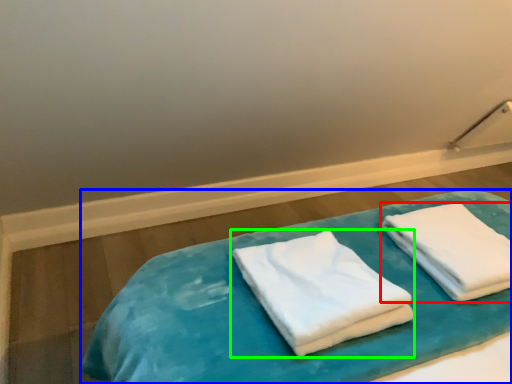
Question: Estimate the real-world distances between objects in this image. Which object is farther from towel (highlighted by a red box), bed (highlighted by a blue box) or towel (highlighted by a green box)?

Choices:
 (A) bed
 (B) towel

Answer: (B)